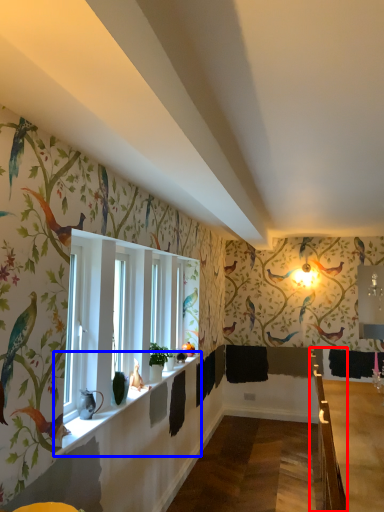
Question: Which point is closer to the camera, rail (highlighted by a red box) or window sill (highlighted by a blue box)?

Choices:
 (A) rail
 (B) window sill

Answer: (B)